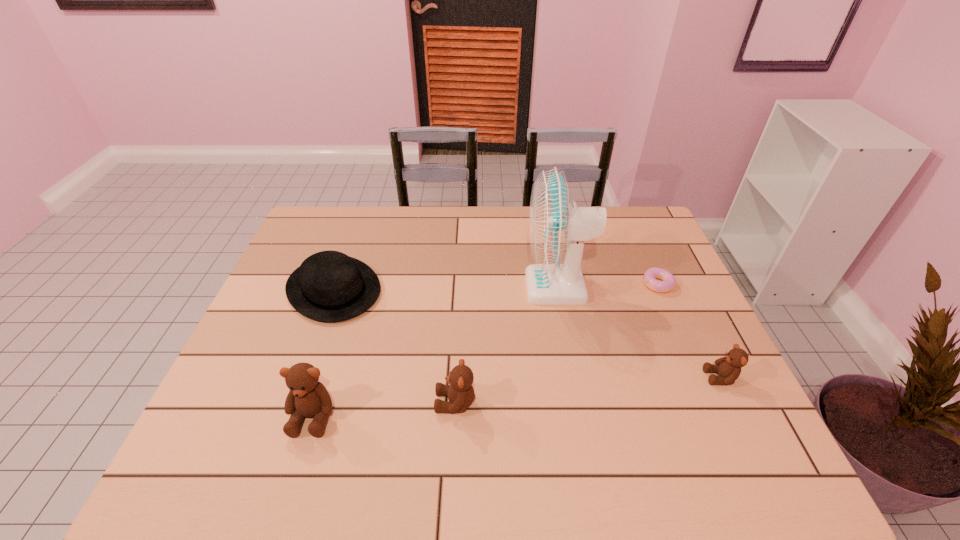
I want to click on the tallest teddy bear, so click(307, 397).

Find the location of a particular element. This screenshot has width=960, height=540. the leftmost teddy bear is located at coordinates (307, 397).

Find the location of a particular element. The width and height of the screenshot is (960, 540). the second shortest teddy bear is located at coordinates (460, 392).

Locate an element on the screen. The image size is (960, 540). the second teddy bear from left to right is located at coordinates (460, 392).

This screenshot has height=540, width=960. I want to click on the rightmost teddy bear, so click(728, 368).

Image resolution: width=960 pixels, height=540 pixels. I want to click on fedora, so click(x=329, y=286).

At what (x,y) coordinates should I click in order to perform the action: click on doughnut. Please return your answer as a coordinate pair (x, y). The height and width of the screenshot is (540, 960). Looking at the image, I should click on (650, 277).

At what (x,y) coordinates should I click in order to perform the action: click on the tallest object. Please return your answer as a coordinate pair (x, y). The height and width of the screenshot is (540, 960). Looking at the image, I should click on 557,231.

Identify the location of fan. Image resolution: width=960 pixels, height=540 pixels. (557, 231).

Where is `free space located 0.360m on the face of the second teddy bear from right to left`? Image resolution: width=960 pixels, height=540 pixels. free space located 0.360m on the face of the second teddy bear from right to left is located at coordinates (280, 402).